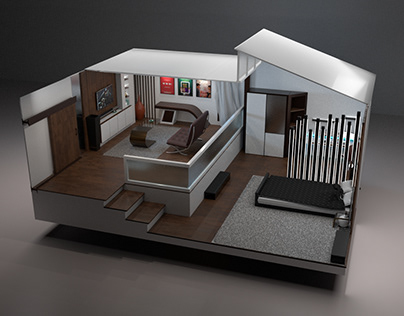
Locate an element on the screen. This screenshot has width=404, height=316. top curved shelf on the right side of the tall cabinet on the right is located at coordinates (298, 101).